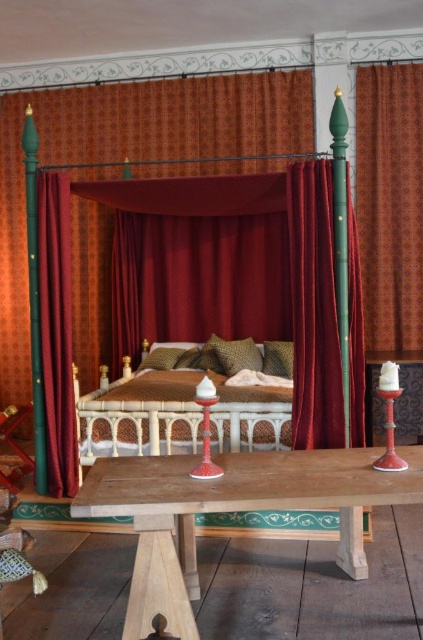
Which of these two, velvet curtain at right or velvet curtain at left, stands shorter?

velvet curtain at right is shorter.

Locate an element on the screen. This screenshot has height=640, width=423. velvet curtain at right is located at coordinates (313, 307).

Is wooden table at lower center wider than patterned fabric curtain at right?

Indeed, wooden table at lower center has a greater width compared to patterned fabric curtain at right.

Is wooden table at lower center to the left of patterned fabric curtain at right from the viewer's perspective?

Correct, you'll find wooden table at lower center to the left of patterned fabric curtain at right.

Find the location of a particular element. wooden table at lower center is located at coordinates (230, 509).

Between leopard print pillow at center and velvet cushion at center, which one is positioned lower?

Positioned lower is velvet cushion at center.

Is leopard print pillow at center to the right of velvet cushion at center from the viewer's perspective?

In fact, leopard print pillow at center is to the left of velvet cushion at center.

Locate an element on the screen. leopard print pillow at center is located at coordinates (236, 355).

Find the location of a particular element. leopard print pillow at center is located at coordinates (236, 355).